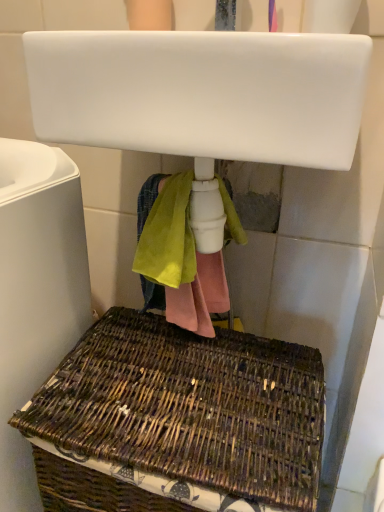
The width and height of the screenshot is (384, 512). Describe the element at coordinates (177, 418) in the screenshot. I see `brown woven picnic basket at lower center` at that location.

Where is `brown woven picnic basket at lower center`? brown woven picnic basket at lower center is located at coordinates (177, 418).

Is white glossy sink at upper center at the back of brown woven picnic basket at lower center?

No, brown woven picnic basket at lower center's orientation is not away from white glossy sink at upper center.

Which is in front, point (270, 471) or point (263, 106)?

The point (263, 106) is more forward.

Who is taller, brown woven picnic basket at lower center or white glossy sink at upper center?

With more height is brown woven picnic basket at lower center.

Is white glossy sink at upper center situated inside brown woven picnic basket at lower center or outside?

white glossy sink at upper center exists outside the volume of brown woven picnic basket at lower center.

Is there a large distance between white glossy sink at upper center and brown woven picnic basket at lower center?

No.

Which object is positioned more to the right, white glossy sink at upper center or brown woven picnic basket at lower center?

Positioned to the right is white glossy sink at upper center.

Based on the photo, from a real-world perspective, is white glossy sink at upper center positioned above or below brown woven picnic basket at lower center?

In terms of real-world spatial position, white glossy sink at upper center is above brown woven picnic basket at lower center.

Is woven brown basket at lower left situated inside brown woven picnic basket at lower center or outside?

woven brown basket at lower left exists outside the volume of brown woven picnic basket at lower center.

Relative to brown woven picnic basket at lower center, is woven brown basket at lower left in front or behind?

woven brown basket at lower left is in front of brown woven picnic basket at lower center.

Between woven brown basket at lower left and brown woven picnic basket at lower center, which one has larger size?

Bigger between the two is woven brown basket at lower left.

Is point (61, 181) positioned in front of point (216, 473)?

No, (61, 181) is further to viewer.

Could you tell me if brown woven picnic basket at lower center is facing woven brown basket at lower left?

No, brown woven picnic basket at lower center is not facing towards woven brown basket at lower left.

Is brown woven picnic basket at lower center not close to woven brown basket at lower left?

No.

Is white glossy sink at upper center located within woven brown basket at lower left?

No.

Which object is further away from the camera taking this photo, woven brown basket at lower left or white glossy sink at upper center?

woven brown basket at lower left is more distant.

Does woven brown basket at lower left appear on the right side of white glossy sink at upper center?

No.

In terms of height, does woven brown basket at lower left look taller or shorter compared to white glossy sink at upper center?

woven brown basket at lower left is taller than white glossy sink at upper center.

Is woven brown basket at lower left a part of white glossy sink at upper center?

No, woven brown basket at lower left is located outside of white glossy sink at upper center.

Which object is positioned more to the right, white glossy sink at upper center or woven brown basket at lower left?

white glossy sink at upper center.

Which of these two, white glossy sink at upper center or woven brown basket at lower left, is thinner?

Thinner between the two is white glossy sink at upper center.

Where is `picnic basket on the left side of white glossy sink at upper center`? Image resolution: width=384 pixels, height=512 pixels. picnic basket on the left side of white glossy sink at upper center is located at coordinates (177, 418).

Find the location of a particular element. The height and width of the screenshot is (512, 384). picnic basket that appears behind the white glossy sink at upper center is located at coordinates (177, 418).

Which object lies further to the anchor point woven brown basket at lower left, white glossy sink at upper center or brown woven picnic basket at lower center?

white glossy sink at upper center is further to woven brown basket at lower left.

Based on their spatial positions, is brown woven picnic basket at lower center or white glossy sink at upper center further from woven brown basket at lower left?

white glossy sink at upper center lies further to woven brown basket at lower left than the other object.

Looking at this image, estimate the real-world distances between objects in this image. Which object is closer to brown woven picnic basket at lower center, white glossy sink at upper center or woven brown basket at lower left?

woven brown basket at lower left.

From the image, which object appears to be nearer to white glossy sink at upper center, woven brown basket at lower left or brown woven picnic basket at lower center?

woven brown basket at lower left.

When comparing their distances from white glossy sink at upper center, does brown woven picnic basket at lower center or woven brown basket at lower left seem further?

brown woven picnic basket at lower center is further to white glossy sink at upper center.

Considering their positions, is woven brown basket at lower left positioned closer to brown woven picnic basket at lower center than white glossy sink at upper center?

Based on the image, woven brown basket at lower left appears to be nearer to brown woven picnic basket at lower center.

Where is `bath between white glossy sink at upper center and brown woven picnic basket at lower center in the vertical direction`? This screenshot has height=512, width=384. bath between white glossy sink at upper center and brown woven picnic basket at lower center in the vertical direction is located at coordinates (36, 292).